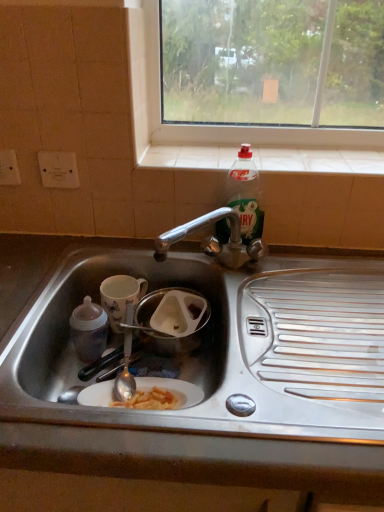
You are a GUI agent. You are given a task and a screenshot of the screen. Output one action in this format:
    pyautogui.click(x=<x>, y=<y>)
    Task: Click on the free spot above white tile at upper center (from a real-world perspective)
    This screenshot has height=512, width=384.
    Given the screenshot: What is the action you would take?
    pyautogui.click(x=266, y=156)